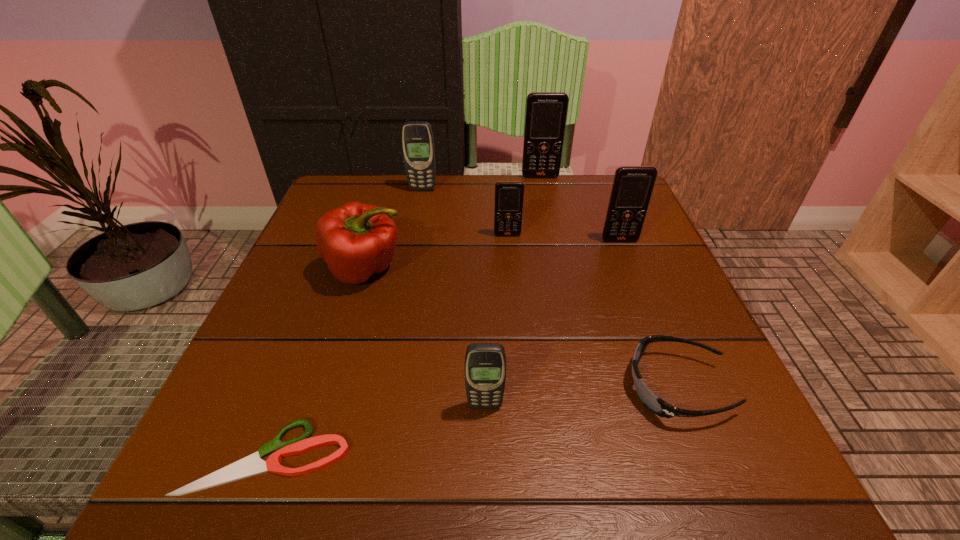
This screenshot has width=960, height=540. In order to click on orange cellular telephone object that ranks as the closest to the left gray cellular telephone in this screenshot , I will do `click(546, 112)`.

Where is `the closest orange cellular telephone to the nearest cellular telephone`? the closest orange cellular telephone to the nearest cellular telephone is located at coordinates (509, 195).

Identify the location of vacant space that satisfies the following two spatial constraints: 1. on the screen of the rightmost cellular telephone; 2. on the lenses of the sunglasses. Image resolution: width=960 pixels, height=540 pixels. (679, 387).